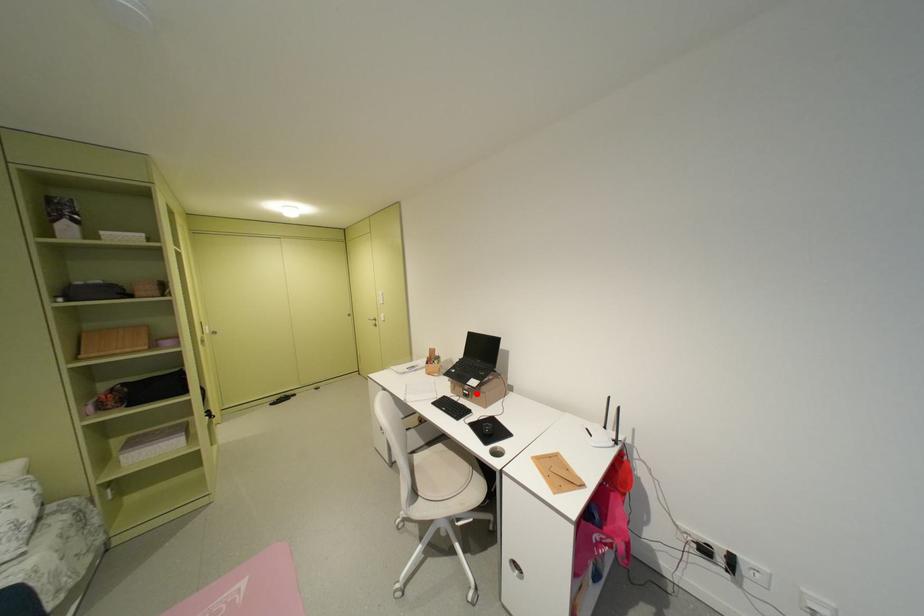
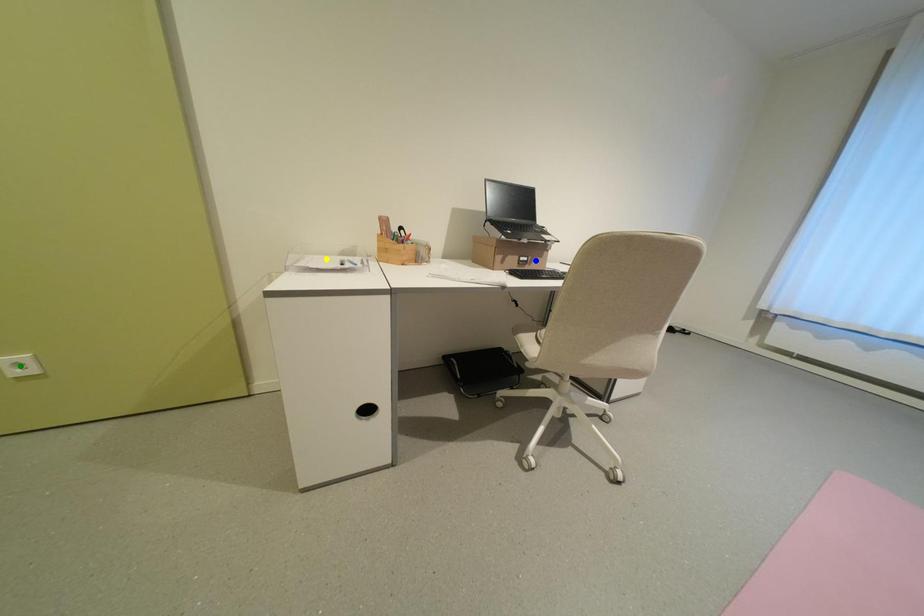
Question: I am providing you with two images of the same scene from different viewpoints. A red point is marked on the first image. You are given multiple points on the second image. Which point in image 2 is actually the same real-world point as the red point in image 1?

Choices:
 (A) blue point
 (B) green point
 (C) yellow point

Answer: (A)